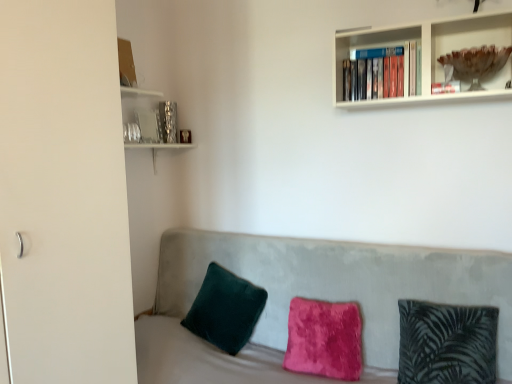
Question: From a real-world perspective, relative to fuzzy pink pillow at center, the second pillow from the right, is velvet couch at center vertically above or below?

Choices:
 (A) above
 (B) below

Answer: (B)

Question: Considering the positions of point [x=271, y=332] and point [x=307, y=307], is point [x=271, y=332] closer or farther from the camera than point [x=307, y=307]?

Choices:
 (A) closer
 (B) farther

Answer: (B)

Question: Estimate the real-world distances between objects in this image. Which object is farther from the velvet green pillow at left, placed as the first pillow when sorted from left to right?

Choices:
 (A) white matte glass door at left
 (B) velvet green pillow at right, which is the first pillow in right-to-left order
 (C) translucent glass bowl at upper right
 (D) velvet couch at center
 (E) fuzzy pink pillow at center, positioned as the 2th pillow in left-to-right order

Answer: (C)

Question: Estimate the real-world distances between objects in this image. Which object is farther from the white matte glass door at left?

Choices:
 (A) translucent glass bowl at upper right
 (B) velvet green pillow at right, which is the first pillow in right-to-left order
 (C) velvet couch at center
 (D) fuzzy pink pillow at center, positioned as the 2th pillow in left-to-right order
 (E) velvet green pillow at left, which appears as the 3th pillow when viewed from the right

Answer: (A)